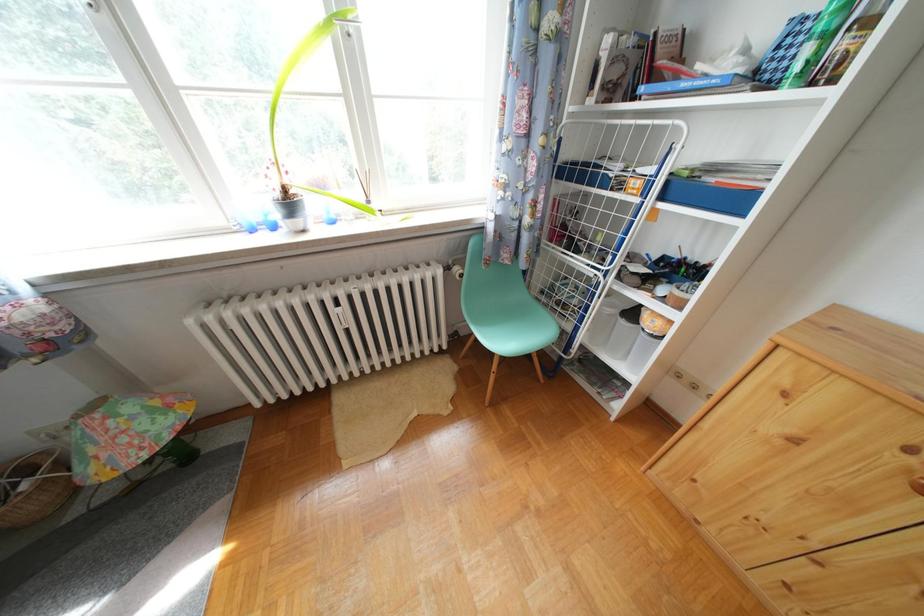
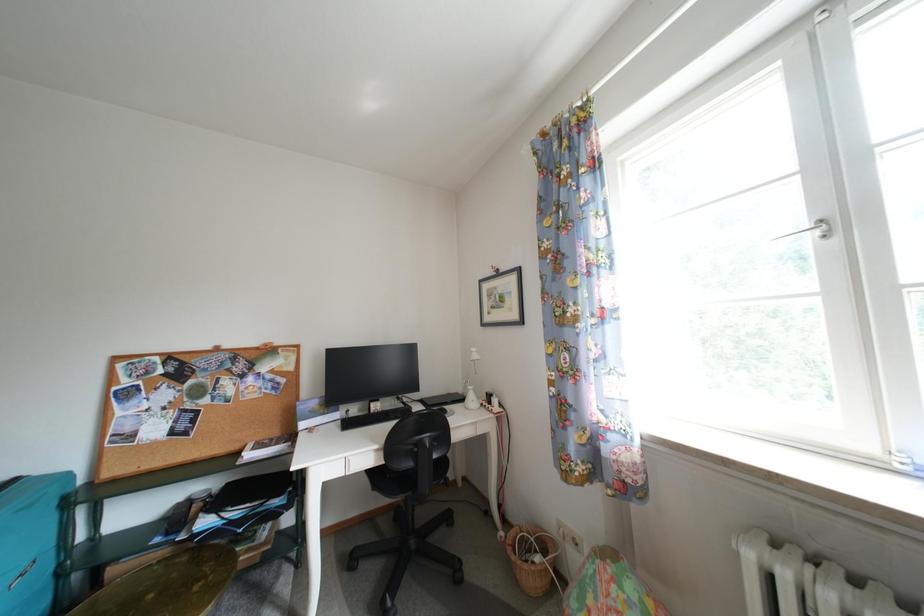
Question: The first image is from the beginning of the video and the second image is from the end. How did the camera likely rotate when shooting the video?

Choices:
 (A) Left
 (B) Right
 (C) Up
 (D) Down

Answer: (A)